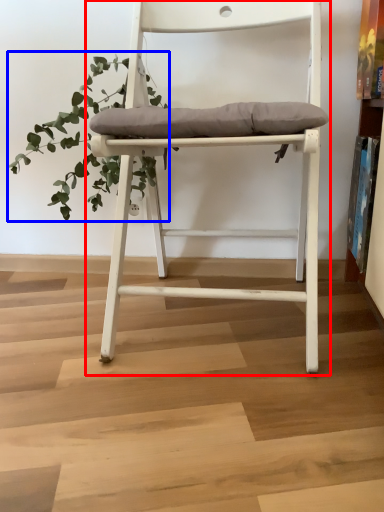
Question: Which of the following is the closest to the observer, chair (highlighted by a red box) or vegetation (highlighted by a blue box)?

Choices:
 (A) chair
 (B) vegetation

Answer: (A)